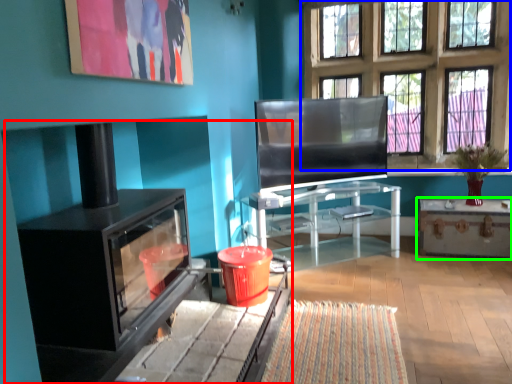
Question: Considering the real-world distances, which object is farthest from fireplace (highlighted by a red box)? window (highlighted by a blue box) or table (highlighted by a green box)?

Choices:
 (A) window
 (B) table

Answer: (A)